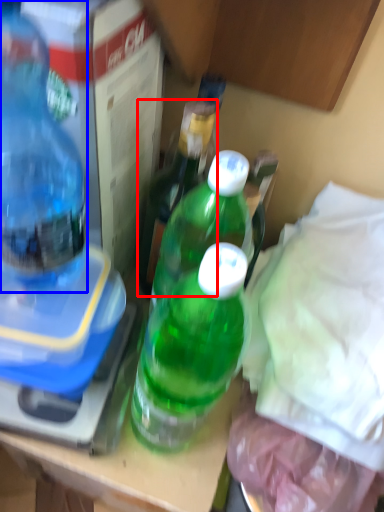
Question: Which object is closer to the camera taking this photo, bottle (highlighted by a red box) or bottle (highlighted by a blue box)?

Choices:
 (A) bottle
 (B) bottle

Answer: (B)